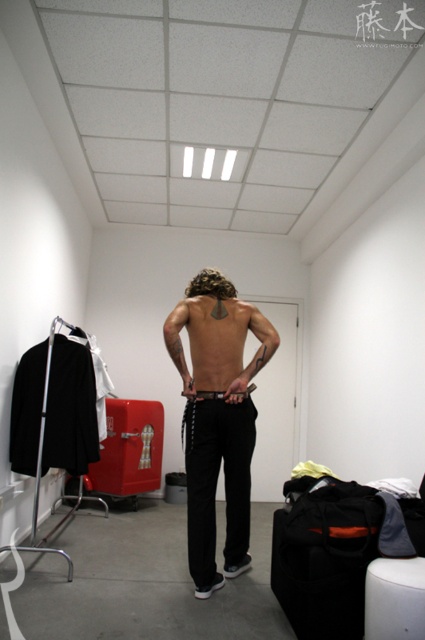
How much distance is there between white plastic stool at lower right and black leather belt at center?

They are 1.09 meters apart.

Which is behind, point (368, 572) or point (201, 394)?

The point (201, 394) is behind.

Find the location of a particular element. Image resolution: width=425 pixels, height=640 pixels. white plastic stool at lower right is located at coordinates (394, 598).

Locate an element on the screen. The image size is (425, 640). black matte pants at center is located at coordinates (217, 419).

Does black matte pants at center have a lesser height compared to white plastic stool at lower right?

No.

The width and height of the screenshot is (425, 640). What do you see at coordinates (217, 419) in the screenshot?
I see `black matte pants at center` at bounding box center [217, 419].

Image resolution: width=425 pixels, height=640 pixels. In order to click on black matte pants at center in this screenshot , I will do `click(217, 419)`.

Is black matte pants at center further to the viewer compared to black leather belt at center?

No, it is in front of black leather belt at center.

Between point (217, 364) and point (243, 392), which one is positioned behind?

The point (217, 364) is more distant.

What are the coordinates of `black matte pants at center` in the screenshot? It's located at (217, 419).